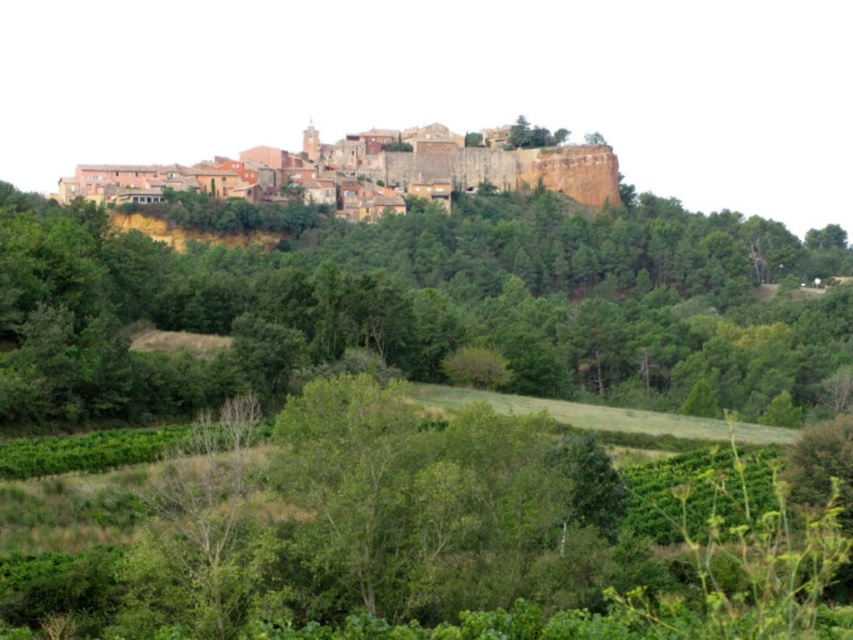
You are standing at the base of the hill looking up at the green leafy tree at upper center and the terracotta stone town at upper center. Which object is closer to you?

The green leafy tree at upper center is closer to you because it is in front of the terracotta stone town at upper center.

You are standing in the vineyard looking up at the hilltop village. You see a green leafy tree at upper center and a terracotta stone town at upper center. Which one is located to the right side of the other?

The green leafy tree at upper center is positioned on the right side of the terracotta stone town at upper center.